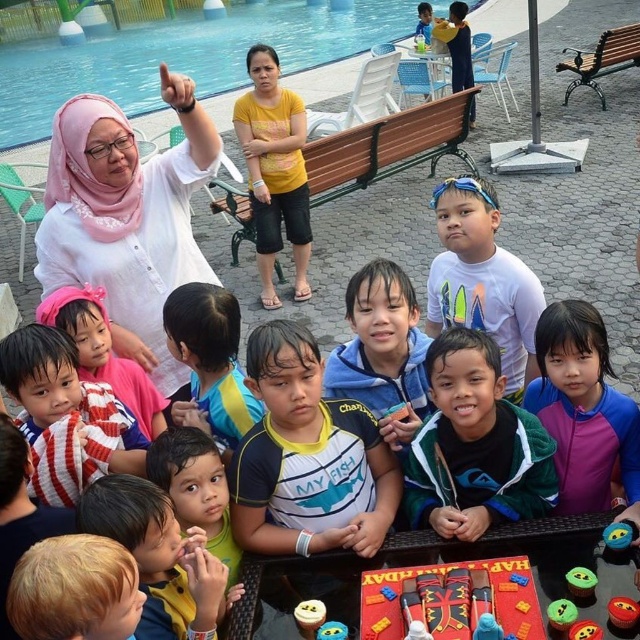
Question: Which of the following is the closest to the observer?

Choices:
 (A) (109, 204)
 (B) (449, 484)
 (C) (256, 35)
 (D) (44, 432)

Answer: (D)

Question: Which of the following is the farthest from the observer?

Choices:
 (A) (336, 12)
 (B) (29, 634)
 (C) (113, 136)
 (D) (620, 536)

Answer: (A)

Question: Does striped jersey at center appear on the left side of blue jersey at center?

Choices:
 (A) no
 (B) yes

Answer: (B)

Question: Does matte white blouse at upper left appear under blue plastic pool at upper left?

Choices:
 (A) no
 (B) yes

Answer: (B)

Question: Considering the relative positions of matte white blouse at upper left and striped fabric shirt at center in the image provided, where is matte white blouse at upper left located with respect to striped fabric shirt at center?

Choices:
 (A) right
 (B) left

Answer: (A)

Question: Which point is farther from the camera taking this photo?

Choices:
 (A) (45, 236)
 (B) (630, 602)
 (C) (570, 637)

Answer: (A)